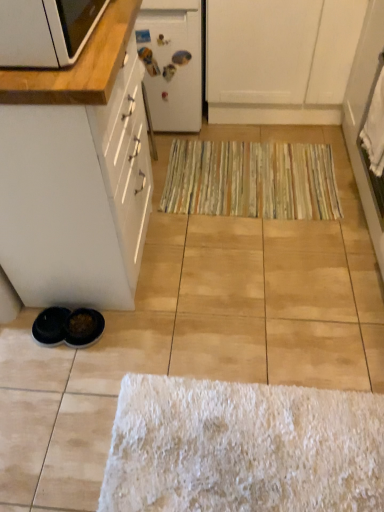
Question: Is white matte cabinet at lower left, the 1th cabinetry when ordered from front to back, beside white matte cabinet at upper center, the first cabinetry when ordered from right to left?

Choices:
 (A) no
 (B) yes

Answer: (A)

Question: From the image's perspective, is white matte cabinet at lower left, placed as the 2th cabinetry when sorted from top to bottom, over white matte cabinet at upper center, which is the 1th cabinetry in back-to-front order?

Choices:
 (A) no
 (B) yes

Answer: (A)

Question: From a real-world perspective, is white matte cabinet at lower left, placed as the 2th cabinetry when sorted from top to bottom, beneath white matte cabinet at upper center, acting as the 2th cabinetry starting from the bottom?

Choices:
 (A) yes
 (B) no

Answer: (B)

Question: Is white matte cabinet at lower left, placed as the 2th cabinetry when sorted from top to bottom, to the left of white matte cabinet at upper center, acting as the 2th cabinetry starting from the bottom, from the viewer's perspective?

Choices:
 (A) yes
 (B) no

Answer: (A)

Question: Is white matte cabinet at lower left, placed as the 2th cabinetry when sorted from top to bottom, at the right side of white matte cabinet at upper center, arranged as the second cabinetry when viewed from the left?

Choices:
 (A) yes
 (B) no

Answer: (B)

Question: From a real-world perspective, is white matte cabinet at lower left, which is counted as the 2th cabinetry, starting from the right, on white matte cabinet at upper center, which is the 1th cabinetry in back-to-front order?

Choices:
 (A) no
 (B) yes

Answer: (B)

Question: Could white matte refrigerator at upper center be considered to be inside white matte cabinet at upper center, which ranks as the 2th cabinetry in front-to-back order?

Choices:
 (A) yes
 (B) no

Answer: (B)

Question: Would you consider white matte cabinet at upper center, which ranks as the 2th cabinetry in front-to-back order, to be distant from white matte refrigerator at upper center?

Choices:
 (A) yes
 (B) no

Answer: (B)

Question: From a real-world perspective, is white matte cabinet at upper center, which ranks as the 2th cabinetry in front-to-back order, positioned under white matte refrigerator at upper center based on gravity?

Choices:
 (A) no
 (B) yes

Answer: (B)

Question: Can you see white matte cabinet at upper center, which is the first cabinetry in top-to-bottom order, touching white matte refrigerator at upper center?

Choices:
 (A) no
 (B) yes

Answer: (A)

Question: Considering the relative sizes of white matte cabinet at upper center, the first cabinetry when ordered from right to left, and white matte refrigerator at upper center in the image provided, is white matte cabinet at upper center, the first cabinetry when ordered from right to left, taller than white matte refrigerator at upper center?

Choices:
 (A) yes
 (B) no

Answer: (B)

Question: Is white matte cabinet at upper center, which is the first cabinetry in top-to-bottom order, positioned with its back to white matte refrigerator at upper center?

Choices:
 (A) no
 (B) yes

Answer: (A)

Question: Is white matte cabinet at lower left, the 1th cabinetry when ordered from left to right, thinner than white matte refrigerator at upper center?

Choices:
 (A) yes
 (B) no

Answer: (A)